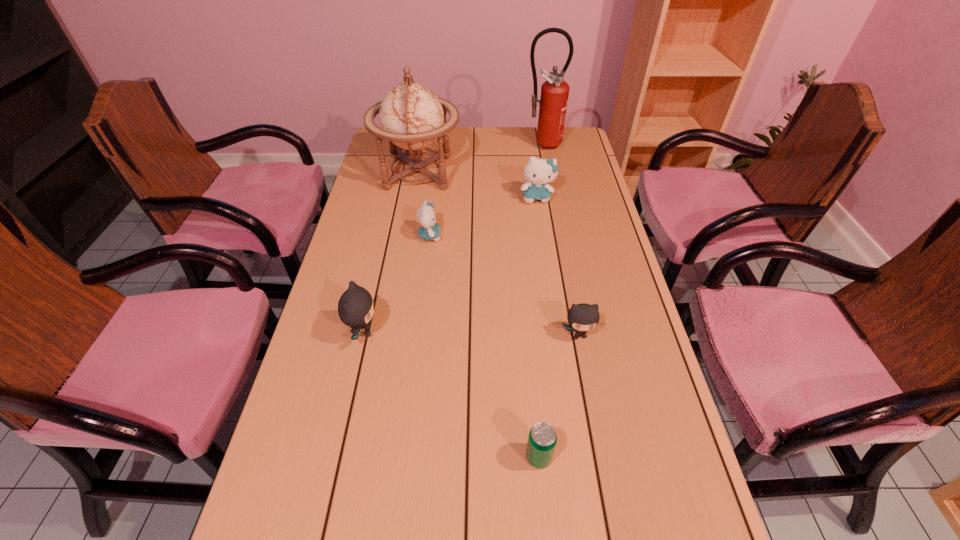
Locate an element on the screen. The width and height of the screenshot is (960, 540). fire extinguisher is located at coordinates (553, 102).

Locate an element on the screen. This screenshot has height=540, width=960. globe is located at coordinates (412, 117).

Locate an element on the screen. The image size is (960, 540). the bigger blue kitten is located at coordinates (539, 172).

This screenshot has width=960, height=540. I want to click on the farthest kitten, so click(539, 172).

Locate an element on the screen. The width and height of the screenshot is (960, 540). the leftmost kitten is located at coordinates (355, 307).

The image size is (960, 540). What are the coordinates of `the bigger gray kitten` in the screenshot? It's located at (355, 307).

The image size is (960, 540). In order to click on the fourth farthest object in this screenshot , I will do `click(430, 229)`.

What are the coordinates of `the second farthest kitten` in the screenshot? It's located at (430, 229).

Locate an element on the screen. The width and height of the screenshot is (960, 540). the right gray kitten is located at coordinates (582, 317).

Find the location of a particular element. The height and width of the screenshot is (540, 960). the nearest object is located at coordinates (542, 439).